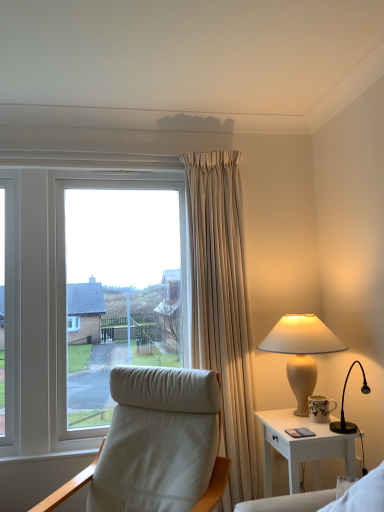
At what (x,y) coordinates should I click in order to perform the action: click on empty space that is ontop of white glossy nightstand at right (from a real-world perspective). Please return your answer as a coordinate pair (x, y). The image size is (384, 512). Looking at the image, I should click on (300, 421).